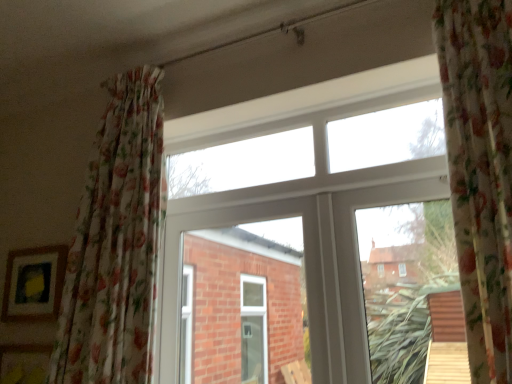
Describe the element at coordinates (116, 243) in the screenshot. I see `floral fabric curtain at left` at that location.

This screenshot has width=512, height=384. Describe the element at coordinates (296, 179) in the screenshot. I see `white plastic window at center` at that location.

What are the coordinates of `floral fabric curtain at left` in the screenshot? It's located at (116, 243).

Is point (151, 113) closer or farther from the camera than point (360, 83)?

Point (151, 113) is farther from the camera than point (360, 83).

Which object is thinner, floral fabric curtain at left or white plastic window at center?

white plastic window at center.

Is floral fabric curtain at left with white plastic window at center?

No, floral fabric curtain at left is not touching white plastic window at center.

From a real-world perspective, is floral fabric curtain at left physically below white plastic window at center?

No.

From a real-world perspective, which object rests below the other?

matte wooden picture frame at lower left, from a real-world perspective.

From the image's perspective, is white plastic window at center above matte wooden picture frame at lower left?

Yes, from the image's perspective, white plastic window at center is above matte wooden picture frame at lower left.

Which object is positioned more to the left, white plastic window at center or matte wooden picture frame at lower left?

From the viewer's perspective, matte wooden picture frame at lower left appears more on the left side.

Find the location of a particular element. This screenshot has height=384, width=512. picture frame behind the floral fabric curtain at left is located at coordinates (34, 283).

From the image's perspective, which is above, floral fabric curtain at left or matte wooden picture frame at lower left?

floral fabric curtain at left.

Between point (89, 324) and point (12, 256), which one is positioned in front?

The point (89, 324) is more forward.

Relative to matte wooden picture frame at lower left, is floral fabric curtain at left in front or behind?

floral fabric curtain at left is positioned closer to the viewer than matte wooden picture frame at lower left.

How different are the orientations of matte wooden picture frame at lower left and floral fabric curtain at left in degrees?

The angular difference between matte wooden picture frame at lower left and floral fabric curtain at left is 0.505 degrees.

In terms of height, does matte wooden picture frame at lower left look taller or shorter compared to floral fabric curtain at left?

matte wooden picture frame at lower left is shorter than floral fabric curtain at left.

Is matte wooden picture frame at lower left in front of or behind floral fabric curtain at left in the image?

matte wooden picture frame at lower left is positioned farther from the viewer than floral fabric curtain at left.

Can floral fabric curtain at left be found inside matte wooden picture frame at lower left?

No, floral fabric curtain at left is not a part of matte wooden picture frame at lower left.

In the scene shown: Considering the relative sizes of matte wooden picture frame at lower left and white plastic window at center in the image provided, is matte wooden picture frame at lower left thinner than white plastic window at center?

Indeed, matte wooden picture frame at lower left has a lesser width compared to white plastic window at center.

Considering the positions of point (31, 265) and point (269, 192), is point (31, 265) closer or farther from the camera than point (269, 192)?

Point (31, 265) is positioned farther from the camera compared to point (269, 192).

Based on the photo, from the image's perspective, is matte wooden picture frame at lower left under white plastic window at center?

Indeed, from the image's perspective, matte wooden picture frame at lower left is shown beneath white plastic window at center.

In the scene shown: Considering the relative positions of matte wooden picture frame at lower left and white plastic window at center in the image provided, is matte wooden picture frame at lower left to the left of white plastic window at center from the viewer's perspective?

Correct, you'll find matte wooden picture frame at lower left to the left of white plastic window at center.

From the image's perspective, does white plastic window at center appear higher than floral fabric curtain at left?

Actually, white plastic window at center appears below floral fabric curtain at left in the image.

Considering the positions of points (232, 123) and (121, 102), is point (232, 123) closer to camera compared to point (121, 102)?

No, (232, 123) is further to viewer.

From the picture: Which is more to the left, white plastic window at center or floral fabric curtain at left?

floral fabric curtain at left.

Can you confirm if white plastic window at center is shorter than floral fabric curtain at left?

Indeed, white plastic window at center has a lesser height compared to floral fabric curtain at left.

Find the location of a particular element. This screenshot has height=384, width=512. curtain lying above the white plastic window at center (from the image's perspective) is located at coordinates (116, 243).

Find the location of `picture frame behind the white plastic window at center`. picture frame behind the white plastic window at center is located at coordinates (34, 283).

Considering their positions, is matte wooden picture frame at lower left positioned closer to white plastic window at center than floral fabric curtain at left?

floral fabric curtain at left lies closer to white plastic window at center than the other object.

When comparing their distances from floral fabric curtain at left, does matte wooden picture frame at lower left or white plastic window at center seem closer?

The object closer to floral fabric curtain at left is white plastic window at center.

Estimate the real-world distances between objects in this image. Which object is further from matte wooden picture frame at lower left, floral fabric curtain at left or white plastic window at center?

white plastic window at center is positioned further to the anchor matte wooden picture frame at lower left.

Considering their positions, is white plastic window at center positioned further to matte wooden picture frame at lower left than floral fabric curtain at left?

white plastic window at center is positioned further to the anchor matte wooden picture frame at lower left.

Looking at the image, which one is located further to floral fabric curtain at left, white plastic window at center or matte wooden picture frame at lower left?

matte wooden picture frame at lower left.

Estimate the real-world distances between objects in this image. Which object is closer to white plastic window at center, floral fabric curtain at left or matte wooden picture frame at lower left?

The object closer to white plastic window at center is floral fabric curtain at left.

Find the location of a particular element. curtain between matte wooden picture frame at lower left and white plastic window at center in the horizontal direction is located at coordinates (116, 243).